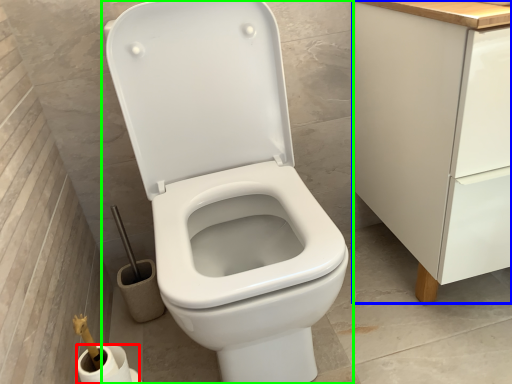
Question: Estimate the real-world distances between objects in this image. Which object is farther from toilet paper (highlighted by a red box), cabinetry (highlighted by a blue box) or toilet (highlighted by a green box)?

Choices:
 (A) cabinetry
 (B) toilet

Answer: (A)